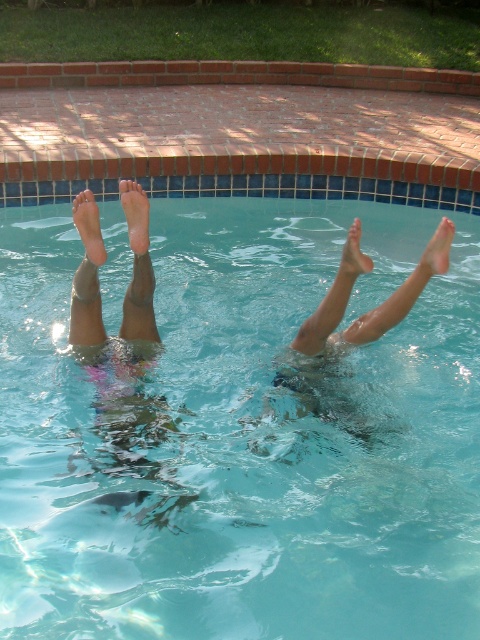
You are a photographer trying to capture the perfect shot of the two sets of legs in the pool. To ensure both skinny legs at center and smooth skin legs at upper center are visible in the frame, which direction should you move your camera? Explain your reasoning based on their positions.

Since the skinny legs at center are to the left of the smooth skin legs at upper center, you should move your camera slightly to the right to include both in the frame. This adjustment will ensure that the leftmost legs remain visible while capturing the rightward position of the other set.

You are a photographer trying to capture the clear glass water at center and the matte skin foot at upper right in a single frame. Based on their positions, which object should you adjust your camera angle to focus on first to ensure both are in the shot?

The clear glass water at center is to the left of matte skin foot at upper right, so you should focus on the matte skin foot at upper right first to ensure both objects are captured in the frame.